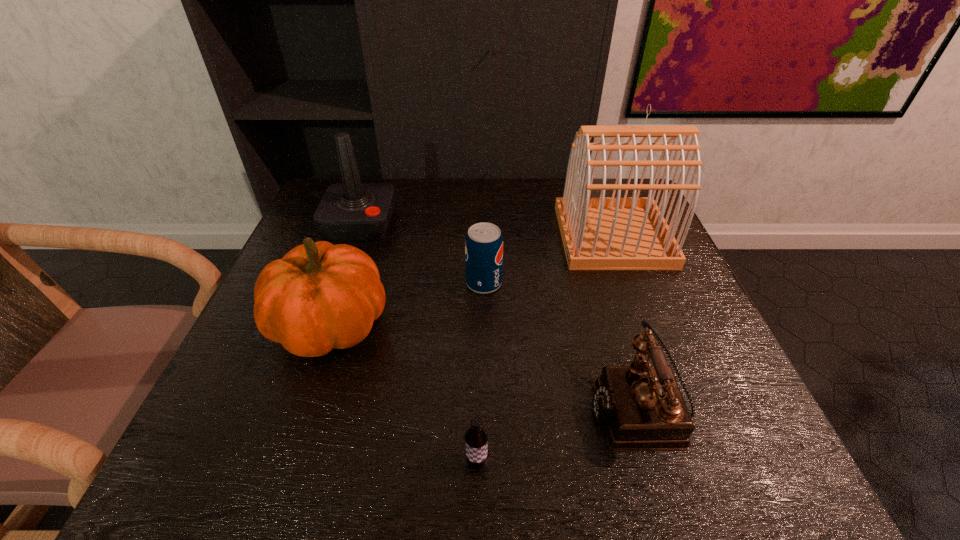
Locate an element on the screen. free space located 0.070m on the back of the pumpkin is located at coordinates (351, 266).

You are a GUI agent. You are given a task and a screenshot of the screen. Output one action in this format:
    pyautogui.click(x=<x>, y=<y>)
    Task: Click on the vacant region located 0.150m on the dial of the telephone
    The width and height of the screenshot is (960, 540).
    Given the screenshot: What is the action you would take?
    pyautogui.click(x=504, y=406)

You are a GUI agent. You are given a task and a screenshot of the screen. Output one action in this format:
    pyautogui.click(x=<x>, y=<y>)
    Task: Click on the free space located on the dial of the telephone
    Image resolution: width=960 pixels, height=540 pixels.
    Given the screenshot: What is the action you would take?
    pyautogui.click(x=539, y=406)

Locate an element on the screen. The width and height of the screenshot is (960, 540). vacant region located on the dial of the telephone is located at coordinates (539, 406).

Locate an element on the screen. The height and width of the screenshot is (540, 960). vacant space located on the right of the pop is located at coordinates [541, 284].

The height and width of the screenshot is (540, 960). Identify the location of vacant space located on the left of the root beer. (332, 463).

In order to click on birdcage that is at the far edge in this screenshot , I will do `click(598, 233)`.

Where is `joystick that is at the far edge`? joystick that is at the far edge is located at coordinates (350, 211).

Image resolution: width=960 pixels, height=540 pixels. I want to click on telephone present at the near edge, so click(x=641, y=407).

The width and height of the screenshot is (960, 540). What are the coordinates of `root beer situated at the near edge` in the screenshot? It's located at (476, 437).